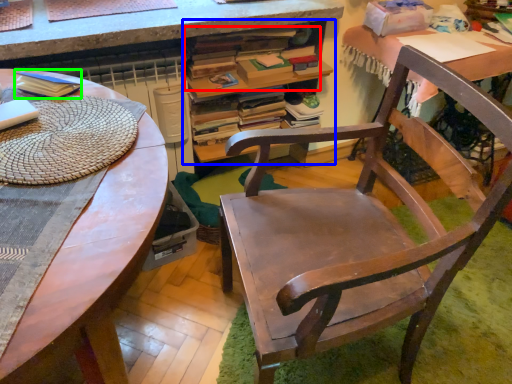
Question: Which object is positioned farthest from book (highlighted by a red box)? Select from desk with bookshelf (highlighted by a blue box) and paperback book (highlighted by a green box).

Choices:
 (A) desk with bookshelf
 (B) paperback book

Answer: (B)